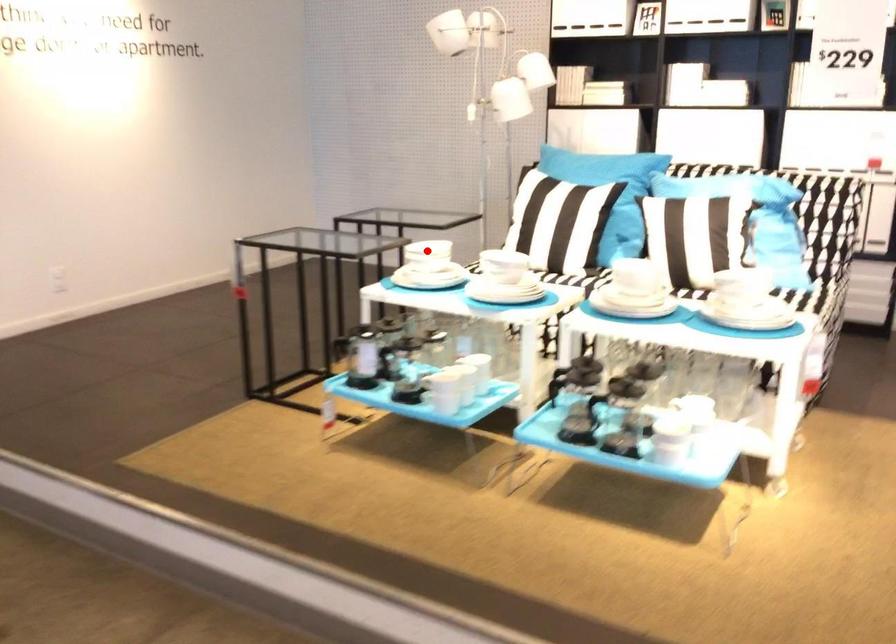
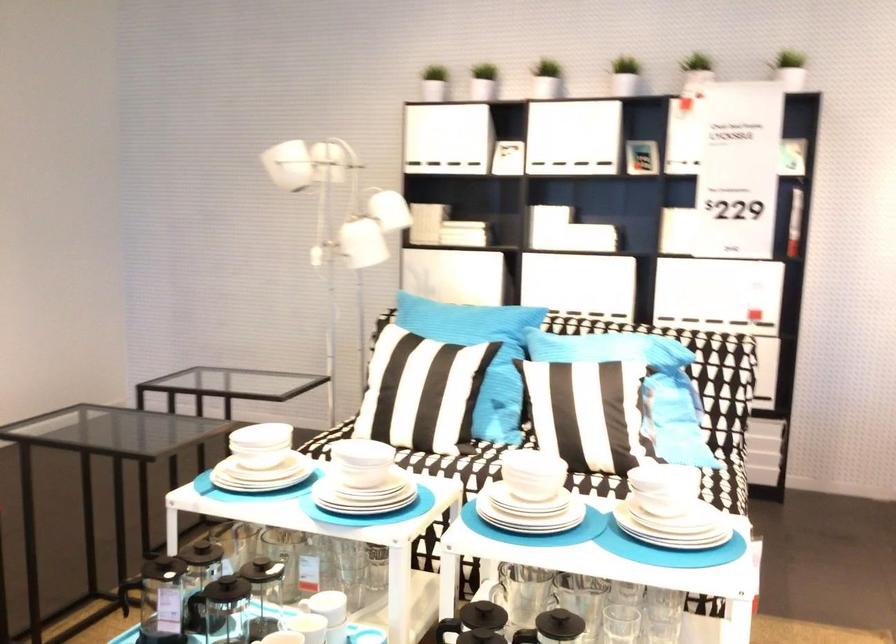
The point at the highlighted location is marked in the first image. Where is the corresponding point in the second image?

(261, 440)